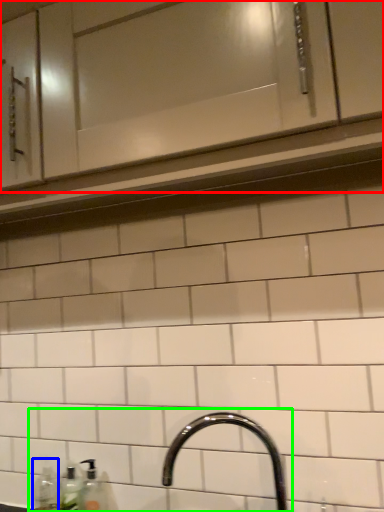
Question: Based on their relative distances, which object is nearer to cabinetry (highlighted by a red box)? Choose from bottle (highlighted by a blue box) and sink (highlighted by a green box).

Choices:
 (A) bottle
 (B) sink

Answer: (B)